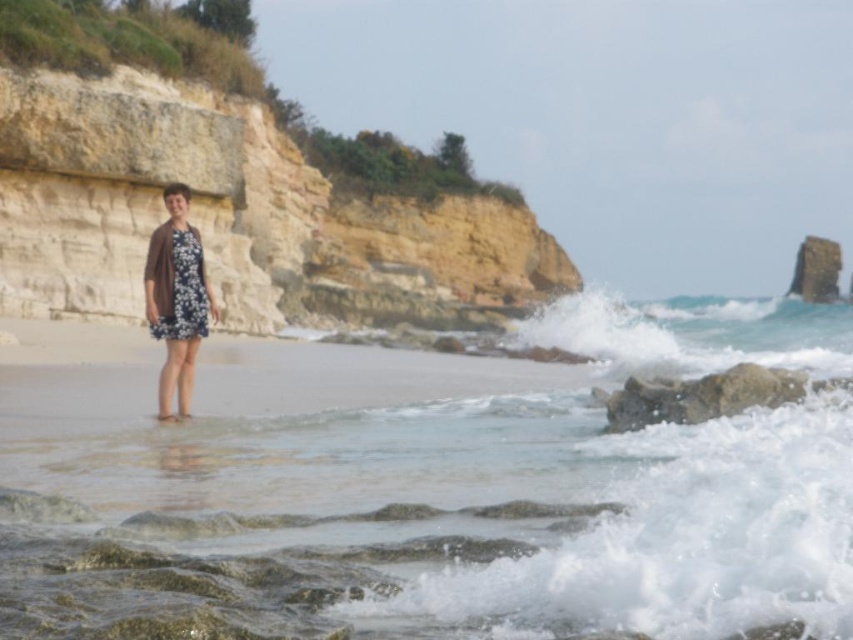
Question: Which object is the closest to the clear water at lower left?

Choices:
 (A) floral dress at center
 (B) smooth sand cliff at center

Answer: (A)

Question: Is smooth sand cliff at center positioned behind floral dress at center?

Choices:
 (A) yes
 (B) no

Answer: (A)

Question: Is clear water at lower left thinner than smooth sand cliff at center?

Choices:
 (A) no
 (B) yes

Answer: (A)

Question: Is clear water at lower left wider than floral dress at center?

Choices:
 (A) yes
 (B) no

Answer: (A)

Question: Considering the real-world distances, which object is farthest from the floral dress at center?

Choices:
 (A) smooth sand cliff at center
 (B) clear water at lower left

Answer: (A)

Question: Based on their relative distances, which object is farther from the smooth sand cliff at center?

Choices:
 (A) floral dress at center
 (B) clear water at lower left

Answer: (A)